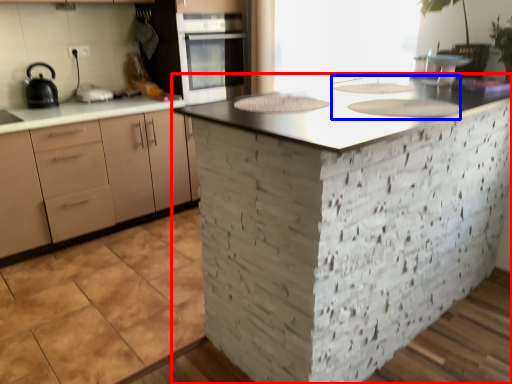
Question: Which of the following is the closest to the observer, countertop (highlighted by a red box) or sink (highlighted by a blue box)?

Choices:
 (A) countertop
 (B) sink

Answer: (A)